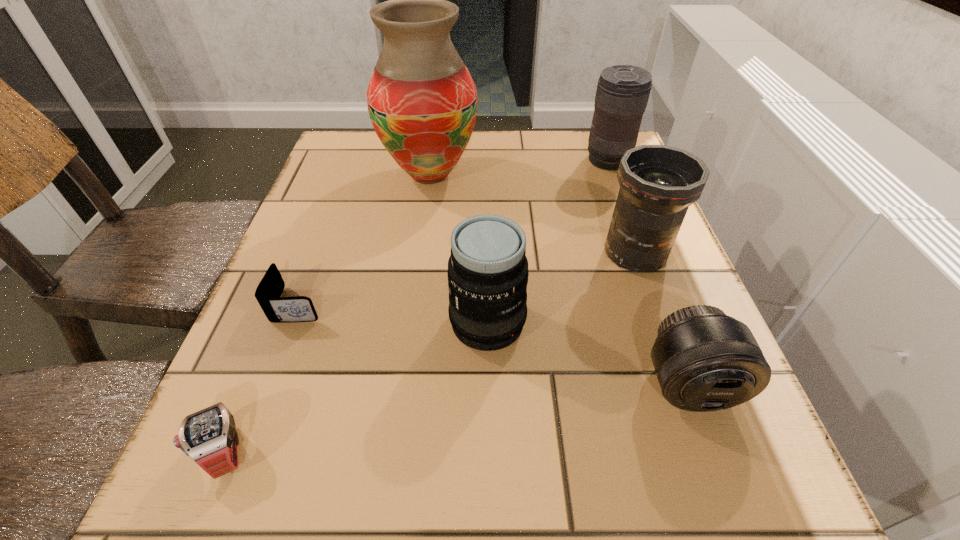
I want to click on vacant space located on the side of the farthest telephoto lens where the control switches are located, so pos(436,160).

Identify the location of blank space located on the front of the third nearest telephoto lens. This screenshot has width=960, height=540. (672, 357).

Where is `vacant space positioned 0.100m on the front of the leftmost telephoto lens`? This screenshot has width=960, height=540. vacant space positioned 0.100m on the front of the leftmost telephoto lens is located at coordinates (489, 414).

Image resolution: width=960 pixels, height=540 pixels. I want to click on vacant space located on the front-facing side of the third shortest object, so tap(727, 488).

Find the location of a particular element. The height and width of the screenshot is (540, 960). free space located on the back of the watch is located at coordinates (259, 370).

Find the location of a particular element. The width and height of the screenshot is (960, 540). vacant space situated on the outer surface of the shortest object is located at coordinates (411, 304).

The width and height of the screenshot is (960, 540). Identify the location of vase at the far edge. (422, 101).

Locate an element on the screen. This screenshot has width=960, height=540. telephoto lens that is at the far edge is located at coordinates (622, 94).

Where is `object present at the near edge`? object present at the near edge is located at coordinates (209, 437).

Locate an element on the screen. The image size is (960, 540). vase present at the left edge is located at coordinates (422, 101).